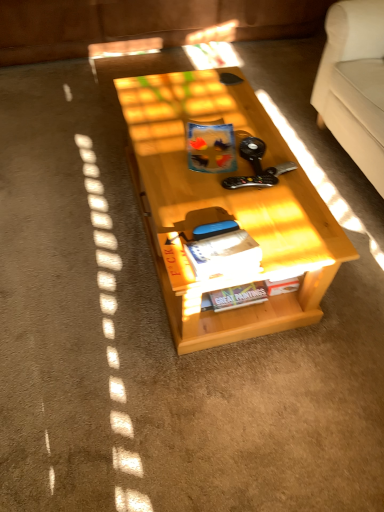
Identify the location of free space in front of light wood table at center. (192, 394).